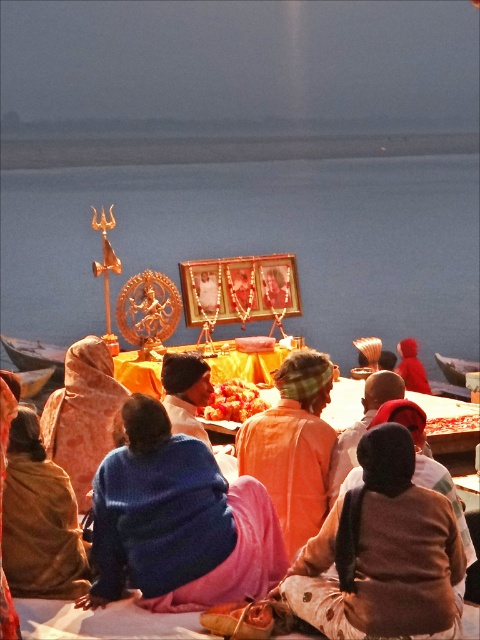
Consider the image. Can you confirm if velvet blue shawl at lower left is bigger than orange fabric cloth at center?

Incorrect, velvet blue shawl at lower left is not larger than orange fabric cloth at center.

Which of these two, velvet blue shawl at lower left or orange fabric cloth at center, stands shorter?

Standing shorter between the two is velvet blue shawl at lower left.

This screenshot has width=480, height=640. Identify the location of velvet blue shawl at lower left. (39, 518).

Where is `velvet blue shawl at lower left`? The height and width of the screenshot is (640, 480). velvet blue shawl at lower left is located at coordinates (39, 518).

Which of these two, blue woolen sweater at lower left or orange printed fabric robe at center, stands taller?

With more height is orange printed fabric robe at center.

Is point (248, 497) positioned in front of point (76, 348)?

Yes, it is in front of point (76, 348).

Where is `blue woolen sweater at lower left`? blue woolen sweater at lower left is located at coordinates (181, 529).

Is orange cotton robe at center shorter than orange printed fabric robe at center?

Indeed, orange cotton robe at center has a lesser height compared to orange printed fabric robe at center.

Is point (278, 449) farther from viewer compared to point (46, 433)?

No, it is not.

This screenshot has width=480, height=640. What do you see at coordinates (289, 465) in the screenshot? I see `orange cotton robe at center` at bounding box center [289, 465].

The height and width of the screenshot is (640, 480). In order to click on orange cotton robe at center in this screenshot , I will do `click(289, 465)`.